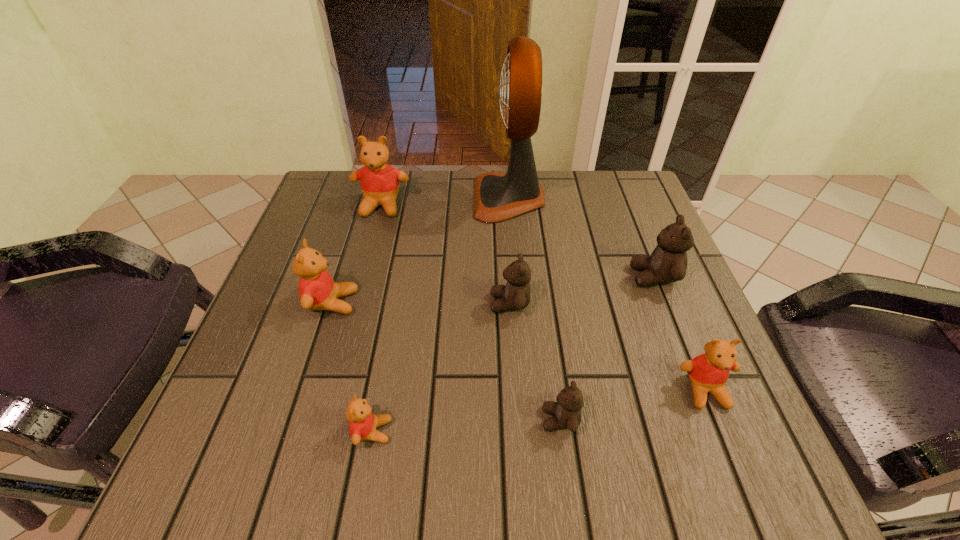
You are a GUI agent. You are given a task and a screenshot of the screen. Output one action in this format:
    pyautogui.click(x=<x>, y=<y>)
    Task: Click on the object at the far left corner
    
    Given the screenshot: What is the action you would take?
    pyautogui.click(x=379, y=181)

I want to click on free space at the far edge, so click(x=545, y=188).

Locate an element on the screen. The image size is (960, 540). vacant space at the near edge of the desktop is located at coordinates (359, 478).

The width and height of the screenshot is (960, 540). I want to click on blank space at the left edge of the desktop, so click(269, 352).

At what (x,y) coordinates should I click in order to perform the action: click on vacant space at the right edge of the desktop. Please return your answer as a coordinate pair (x, y). This screenshot has width=960, height=540. Looking at the image, I should click on (596, 238).

In the image, there is a desktop. Identify the location of blank space at the far right corner. This screenshot has height=540, width=960. (636, 192).

Image resolution: width=960 pixels, height=540 pixels. Identify the location of vacant region between the second biggest red teddy bear and the second biggest brown teddy bear. (420, 303).

Image resolution: width=960 pixels, height=540 pixels. What are the coordinates of `free space between the rightmost brown teddy bear and the smallest red teddy bear` in the screenshot? It's located at (513, 354).

Find the location of a particular element. This screenshot has width=960, height=540. free space that is in between the rightmost brown teddy bear and the second brown teddy bear from left to right is located at coordinates (607, 348).

You are a GUI agent. You are given a task and a screenshot of the screen. Output one action in this format:
    pyautogui.click(x=<x>, y=<y>)
    Task: Click on the free space between the second farthest red teddy bear and the smallest red teddy bear
    
    Given the screenshot: What is the action you would take?
    pyautogui.click(x=352, y=367)